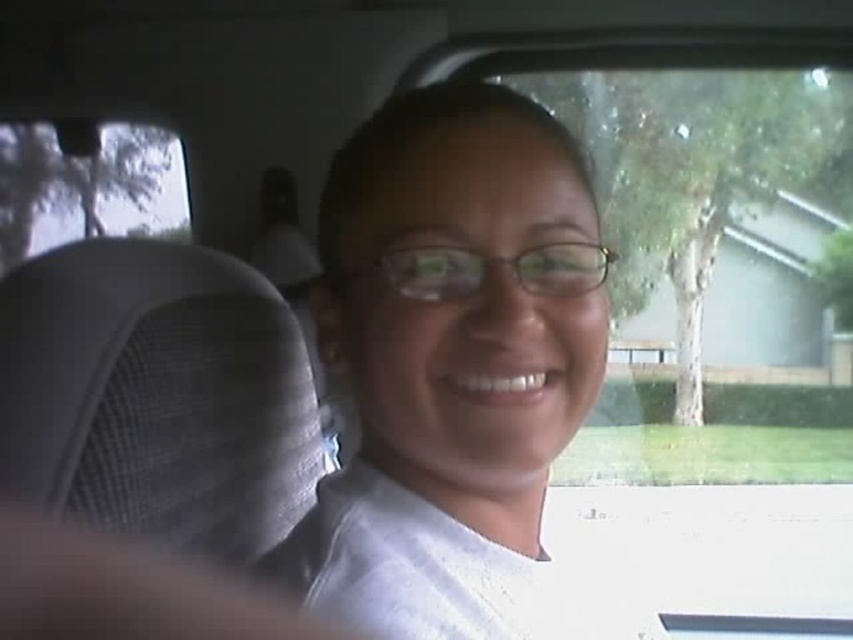
Can you confirm if gray mesh headrest at left is smaller than transparent glass car window at upper left?

Indeed, gray mesh headrest at left has a smaller size compared to transparent glass car window at upper left.

Can you confirm if gray mesh headrest at left is taller than transparent glass car window at upper left?

No, gray mesh headrest at left is not taller than transparent glass car window at upper left.

Measure the distance between point (120,579) and camera.

Point (120,579) and camera are 13.40 inches apart.

Identify the location of gray mesh headrest at left. The height and width of the screenshot is (640, 853). (126, 589).

Can you confirm if white matte shirt at center is positioned below gray mesh headrest at left?

Incorrect, white matte shirt at center is not positioned below gray mesh headrest at left.

Is white matte shirt at center to the left of gray mesh headrest at left from the viewer's perspective?

Incorrect, white matte shirt at center is not on the left side of gray mesh headrest at left.

Who is more forward, (502, 224) or (25, 604)?

Point (25, 604) is more forward.

I want to click on white matte shirt at center, so click(x=456, y=371).

Image resolution: width=853 pixels, height=640 pixels. Describe the element at coordinates (456, 371) in the screenshot. I see `white matte shirt at center` at that location.

Is white matte shirt at center shorter than transparent glass car window at upper left?

Yes.

Looking at this image, who is more forward, (x=556, y=188) or (x=12, y=220)?

Point (x=556, y=188) is in front.

This screenshot has height=640, width=853. I want to click on white matte shirt at center, so click(456, 371).